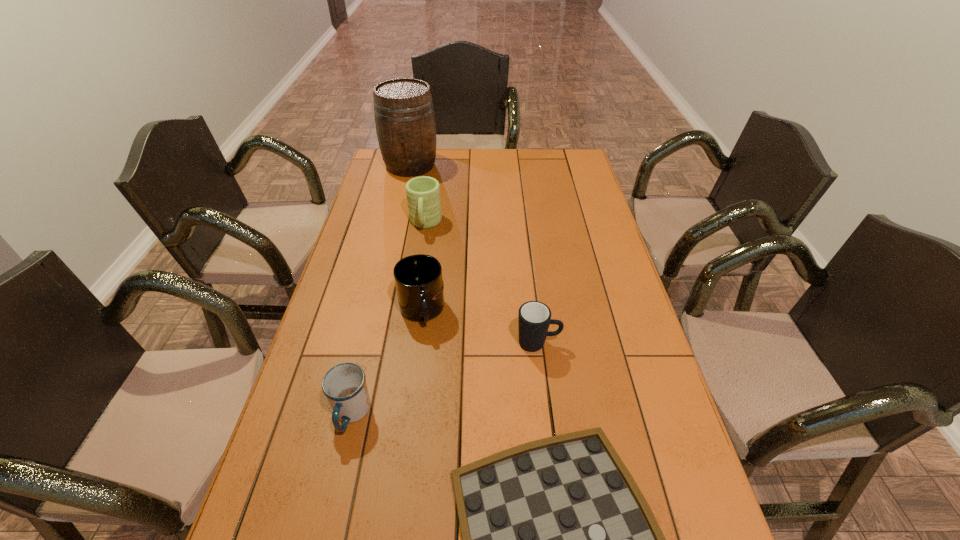
Where is `cider that is at the left edge`? cider that is at the left edge is located at coordinates coord(404,114).

Identify the location of mug positioned at the left edge. (344, 385).

I want to click on object present at the far left corner, so click(404, 114).

The width and height of the screenshot is (960, 540). What are the coordinates of `free region at the far edge of the desktop` in the screenshot? It's located at (454, 160).

The height and width of the screenshot is (540, 960). I want to click on vacant space at the left edge, so click(x=372, y=223).

Where is `vacant space at the right edge of the desktop`? Image resolution: width=960 pixels, height=540 pixels. vacant space at the right edge of the desktop is located at coordinates click(x=642, y=433).

Find the location of `vacant area between the nearest mug and the cider`. vacant area between the nearest mug and the cider is located at coordinates (381, 289).

Identify the location of free area in between the rightmost mug and the tallest object. (474, 254).

Select which object is the second closest to the cider. Please provide its 2D coordinates. Your answer should be formatted as a tuple, i.e. [(x, y)], where the tuple contains the x and y coordinates of a point satisfying the conditions above.

[(419, 284)]

What are the coordinates of `the fourth closest object to the nearest mug` in the screenshot? It's located at (423, 193).